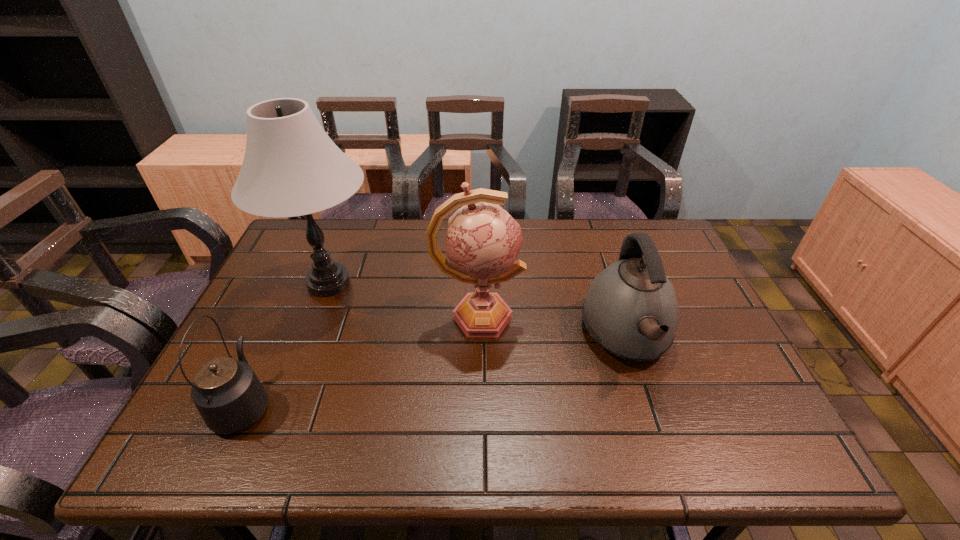
This screenshot has width=960, height=540. I want to click on vacant space located spout on the left kettle, so click(300, 284).

Locate an element on the screen. object present at the far edge is located at coordinates (291, 167).

At what (x,y) coordinates should I click in order to perform the action: click on object at the near edge. Please return your answer as a coordinate pair (x, y). Image resolution: width=960 pixels, height=540 pixels. Looking at the image, I should click on (227, 393).

Find the location of a particular element. This screenshot has width=960, height=540. lamp that is at the left edge is located at coordinates (291, 167).

Image resolution: width=960 pixels, height=540 pixels. Identify the location of kettle located in the left edge section of the desktop. (227, 393).

Find the location of `object that is at the right edge`. object that is at the right edge is located at coordinates (631, 310).

Identify the location of object located in the far left corner section of the desktop. (291, 167).

This screenshot has height=540, width=960. Identify the location of object at the near left corner. (227, 393).

Locate an element on the screen. Image resolution: width=960 pixels, height=540 pixels. free region at the far edge of the desktop is located at coordinates (391, 258).

You are a GUI agent. You are given a task and a screenshot of the screen. Output one action in this format:
    pyautogui.click(x=<x>, y=<y>)
    Task: Click on the vacant area at the near edge of the desktop
    
    Given the screenshot: What is the action you would take?
    tap(295, 423)